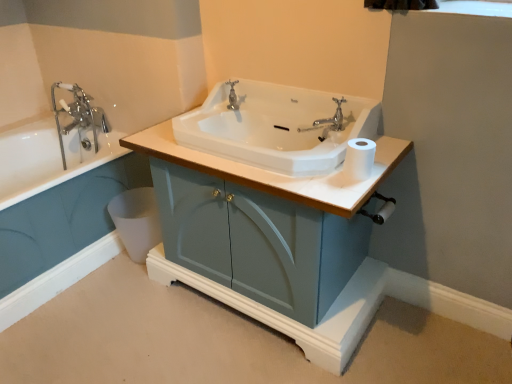
Locate an element on the screen. empty space that is ontop of white plastic toilet bowl at lower left (from a real-world perspective) is located at coordinates (140, 203).